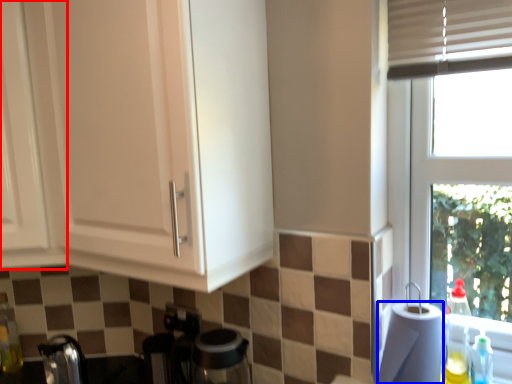
Question: Which object is further to the camera taking this photo, cabinetry (highlighted by a red box) or paper towel (highlighted by a blue box)?

Choices:
 (A) cabinetry
 (B) paper towel

Answer: (A)